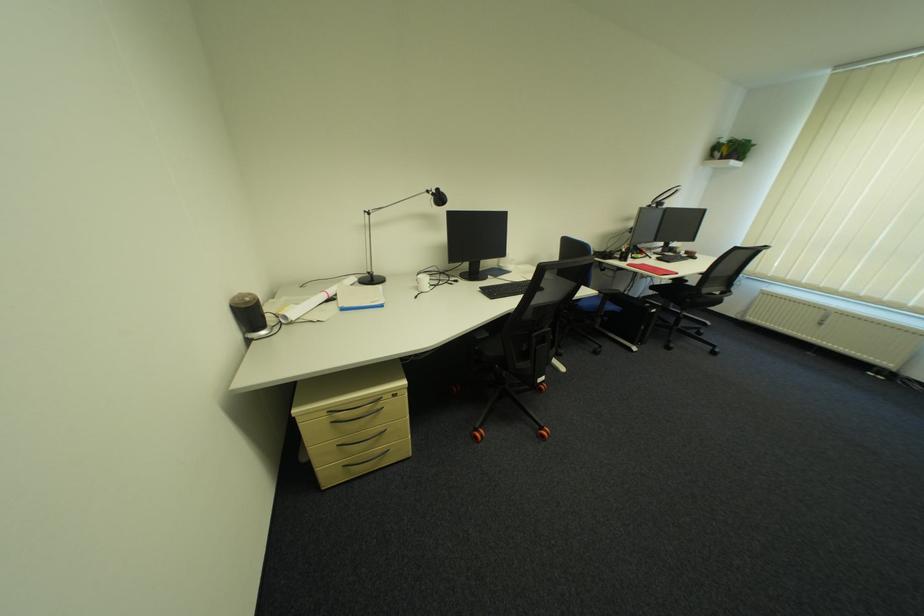
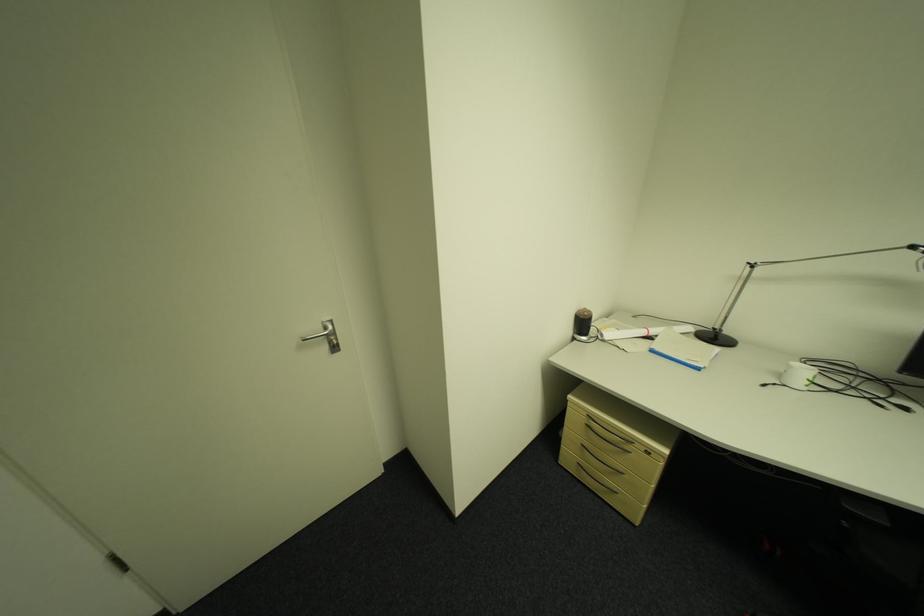
In the second image, find the point that corresponds to point 259,342 in the first image.

(582, 339)